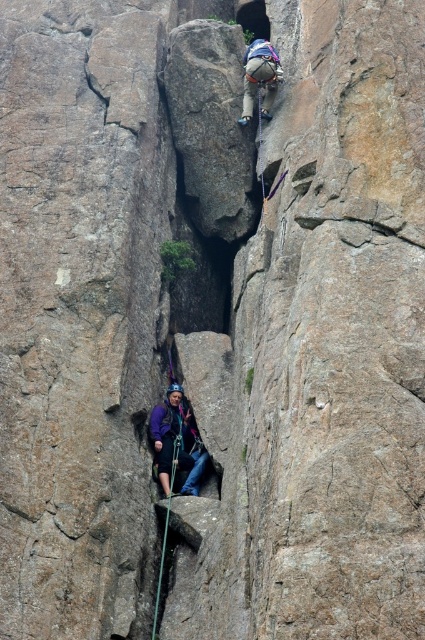
Question: Does purple fabric at center have a smaller size compared to green nylon rope at center?

Choices:
 (A) no
 (B) yes

Answer: (B)

Question: Which of the following is the closest to the observer?

Choices:
 (A) purple fabric at center
 (B) matte gray helmet at upper center

Answer: (A)

Question: Is purple fabric at center to the right of green nylon rope at center from the viewer's perspective?

Choices:
 (A) no
 (B) yes

Answer: (B)

Question: Which object appears closest to the camera in this image?

Choices:
 (A) green nylon rope at center
 (B) purple fabric at center
 (C) matte gray helmet at upper center

Answer: (A)

Question: Which point is closer to the camera?

Choices:
 (A) purple fabric at center
 (B) green nylon rope at center

Answer: (B)

Question: Does purple fabric at center appear on the right side of matte gray helmet at upper center?

Choices:
 (A) no
 (B) yes

Answer: (A)